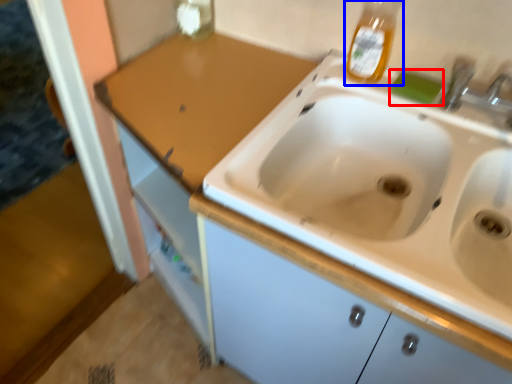
Question: Which of the following is the closest to the observer, soap (highlighted by a red box) or bottle (highlighted by a blue box)?

Choices:
 (A) soap
 (B) bottle

Answer: (B)